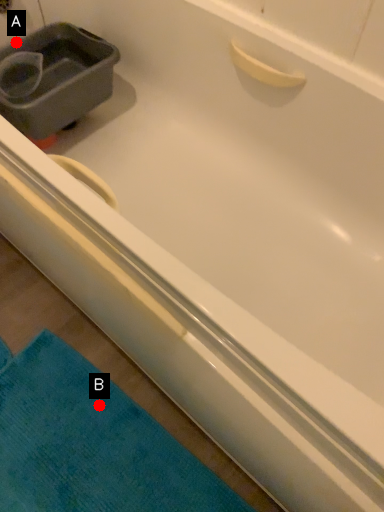
Question: Two points are circled on the image, labeled by A and B beside each circle. Which point appears farthest from the camera in this image?

Choices:
 (A) A is further
 (B) B is further

Answer: (A)